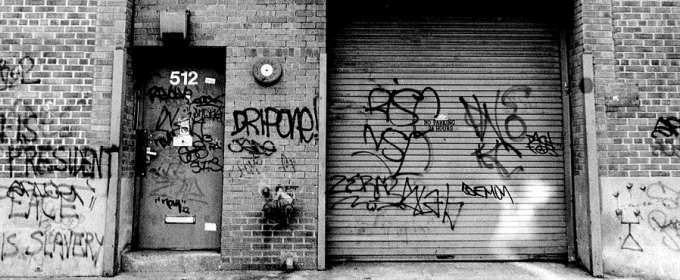
At what (x,y) coordinates should I click in order to perform the action: click on cement parts of walls. Please return your answer as a coordinate pair (x, y). The width and height of the screenshot is (680, 280). Looking at the image, I should click on (39, 221), (644, 225), (583, 223), (122, 213).